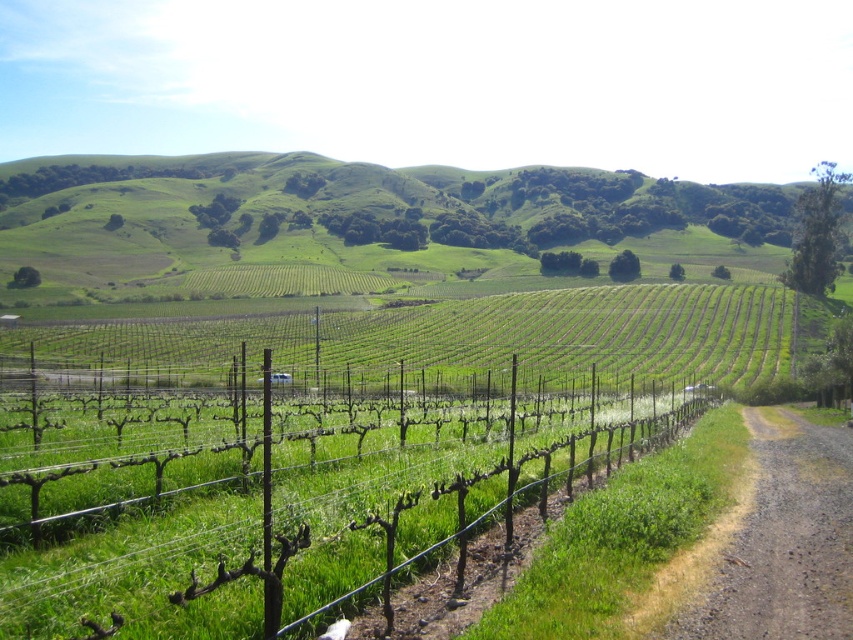
Question: Does green grassy hillside at upper center appear over wire mesh fence at center?

Choices:
 (A) no
 (B) yes

Answer: (B)

Question: Which point is closer to the camera taking this photo?

Choices:
 (A) (250, 618)
 (B) (763, 534)

Answer: (A)

Question: Which object is farther from the camera taking this photo?

Choices:
 (A) green grassy hillside at upper center
 (B) brown gravel path at lower right
 (C) wire mesh fence at center

Answer: (A)

Question: Which object is positioned farthest from the green grassy hillside at upper center?

Choices:
 (A) wire mesh fence at center
 (B) brown gravel path at lower right

Answer: (B)

Question: Is green grassy hillside at upper center thinner than wire mesh fence at center?

Choices:
 (A) yes
 (B) no

Answer: (B)

Question: Can you confirm if wire mesh fence at center is thinner than brown gravel path at lower right?

Choices:
 (A) no
 (B) yes

Answer: (A)